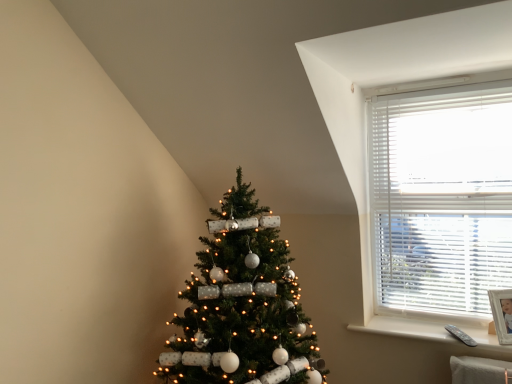
Question: In terms of height, does white plastic remote at lower right look taller or shorter compared to white blinds at upper right?

Choices:
 (A) tall
 (B) short

Answer: (B)

Question: From the image's perspective, is white plastic remote at lower right located above or below white blinds at upper right?

Choices:
 (A) below
 (B) above

Answer: (A)

Question: Which of these objects is positioned closest to the white plastic remote at lower right?

Choices:
 (A) white blinds at upper right
 (B) green matte christmas tree at center

Answer: (A)

Question: Estimate the real-world distances between objects in this image. Which object is closer to the white blinds at upper right?

Choices:
 (A) white plastic remote at lower right
 (B) green matte christmas tree at center

Answer: (A)